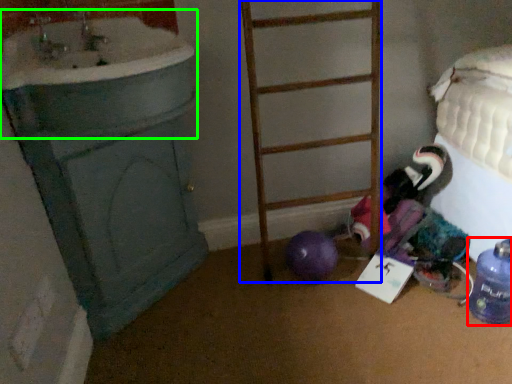
Question: Which is nearer to the bottle (highlighted by a red box)? ladder (highlighted by a blue box) or sink (highlighted by a green box).

Choices:
 (A) ladder
 (B) sink

Answer: (A)